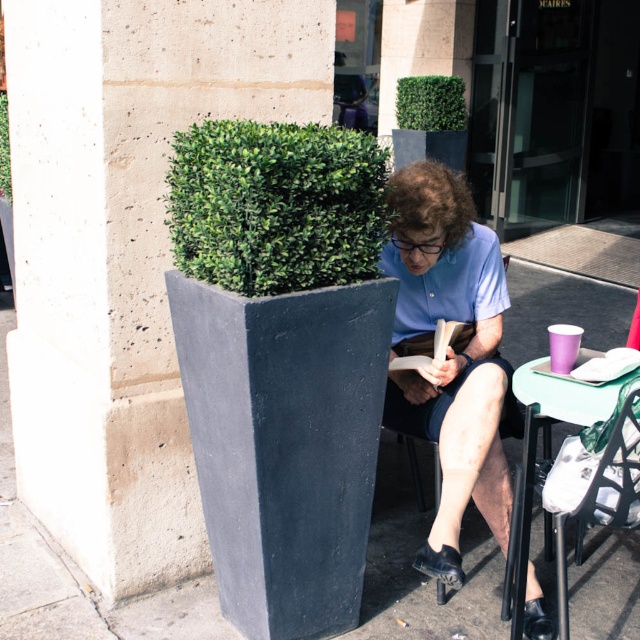
Is green leafy hedge at upper left smaller than green textured hedge at upper left?

No, green leafy hedge at upper left is not smaller than green textured hedge at upper left.

Who is lower down, green leafy hedge at upper left or green textured hedge at upper left?

green leafy hedge at upper left is lower down.

Is point (307, 209) farther from viewer compared to point (3, 186)?

No, it is in front of (3, 186).

I want to click on green leafy hedge at upper left, so click(275, 205).

Measure the distance between light blue shirt at center and green leafy hedge at upper left.

A distance of 19.50 inches exists between light blue shirt at center and green leafy hedge at upper left.

Is light blue shirt at center positioned behind green leafy hedge at upper left?

Yes, it is behind green leafy hedge at upper left.

The image size is (640, 640). Identify the location of light blue shirt at center. (451, 353).

Is green leafy hedge at upper left wider than green textured hedge at upper center?

Yes, green leafy hedge at upper left is wider than green textured hedge at upper center.

Does green leafy hedge at upper left have a lesser width compared to green textured hedge at upper center?

No.

Who is more forward, (376,176) or (413,81)?

Point (376,176)

You are a GUI agent. You are given a task and a screenshot of the screen. Output one action in this format:
    pyautogui.click(x=<x>, y=<y>)
    Task: Click on the green leafy hedge at upper left
    
    Given the screenshot: What is the action you would take?
    pyautogui.click(x=275, y=205)